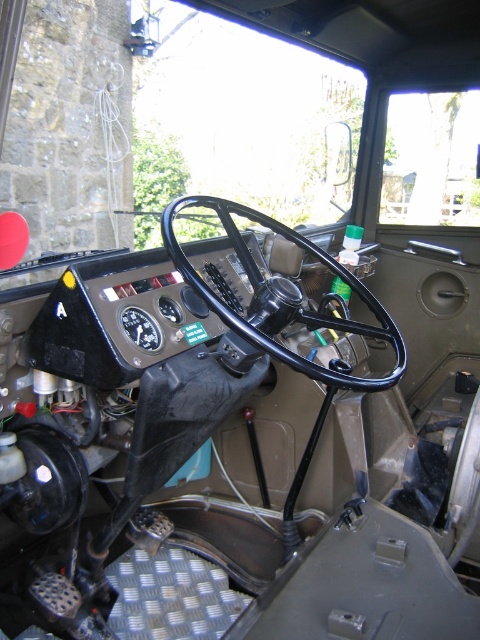
You are a delivery driver who needs to check the distance between your eyes and the transparent glass windshield at upper center. According to the vehicle manufacturer, the recommended distance is between 6 to 7 meters for optimal visibility and safety. Is your current distance within the recommended range?

The transparent glass windshield at upper center is 6.64 meters from camera, which falls within the recommended 6 to 7 meters range for optimal visibility and safety.

You are a passenger sitting in the front seat of the vehicle. You want to look at the black rubber steering wheel at center through the transparent glass windshield at upper center. Can you see it clearly?

The black rubber steering wheel at center is behind the transparent glass windshield at upper center, so yes, you can see it clearly through the windshield.

You are a passenger in the vehicle and want to see the road ahead clearly. Which object, the transparent glass windshield at upper center or the black rubber steering wheel at center, would you look through to have a clear view?

The transparent glass windshield at upper center is bigger than the black rubber steering wheel at center, so you should look through the transparent glass windshield at upper center to have a clear view.